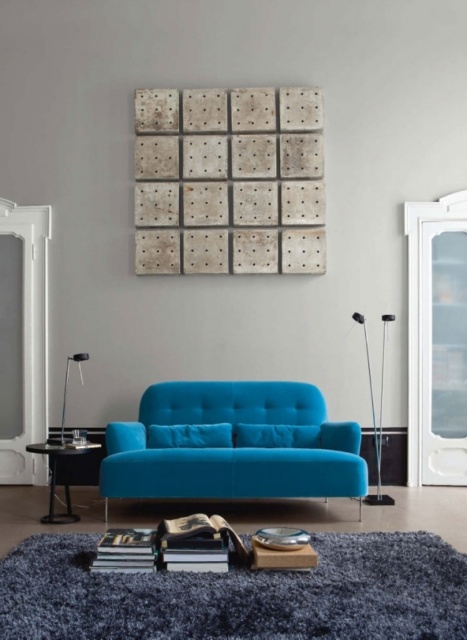
Question: Is teal velvet sofa at center wider than matte black side table at lower left?

Choices:
 (A) yes
 (B) no

Answer: (A)

Question: Among these objects, which one is farthest from the camera?

Choices:
 (A) teal velvet sofa at center
 (B) matte black side table at lower left

Answer: (A)

Question: Considering the relative positions of teal velvet sofa at center and matte black side table at lower left in the image provided, where is teal velvet sofa at center located with respect to matte black side table at lower left?

Choices:
 (A) above
 (B) below

Answer: (A)

Question: Is teal velvet sofa at center to the right of matte black side table at lower left from the viewer's perspective?

Choices:
 (A) yes
 (B) no

Answer: (A)